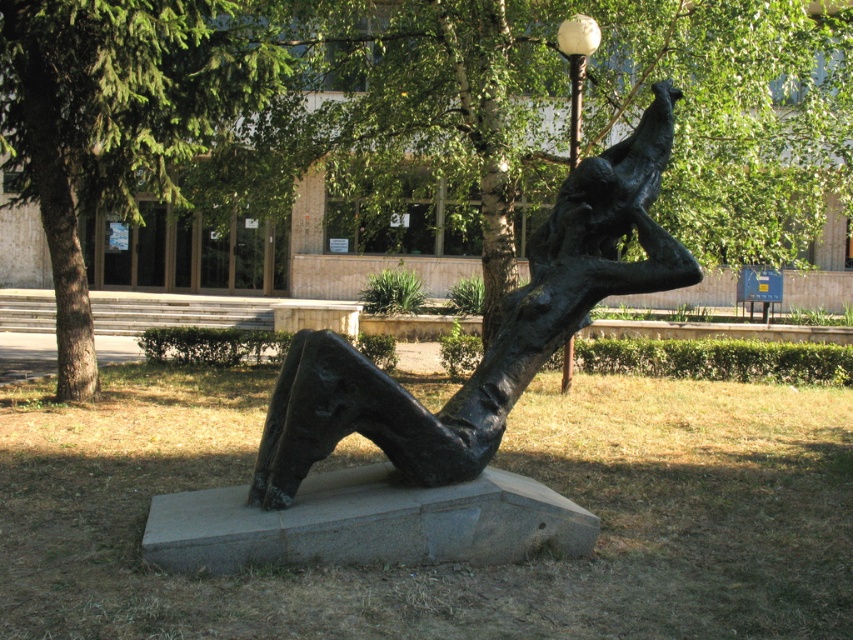
Locate an element on the screen. The width and height of the screenshot is (853, 640). green leafy tree at upper center is located at coordinates (498, 145).

Can you confirm if green leafy tree at upper center is bigger than green leafy tree at upper left?

Yes, green leafy tree at upper center is bigger than green leafy tree at upper left.

This screenshot has height=640, width=853. What do you see at coordinates (498, 145) in the screenshot? I see `green leafy tree at upper center` at bounding box center [498, 145].

Where is `green leafy tree at upper center`? This screenshot has height=640, width=853. green leafy tree at upper center is located at coordinates (498, 145).

Who is higher up, green leafy tree at upper center or bronze statue at center?

green leafy tree at upper center is higher up.

Does green leafy tree at upper center appear under bronze statue at center?

No, green leafy tree at upper center is not below bronze statue at center.

The height and width of the screenshot is (640, 853). Find the location of `green leafy tree at upper center`. green leafy tree at upper center is located at coordinates (498, 145).

Locate an element on the screen. green leafy tree at upper left is located at coordinates (117, 118).

Who is taller, green leafy tree at upper left or white glass ball at upper center?

green leafy tree at upper left

Who is more distant from viewer, [138,100] or [572,77]?

The point [572,77] is more distant.

What are the coordinates of `green leafy tree at upper left` in the screenshot? It's located at 117,118.